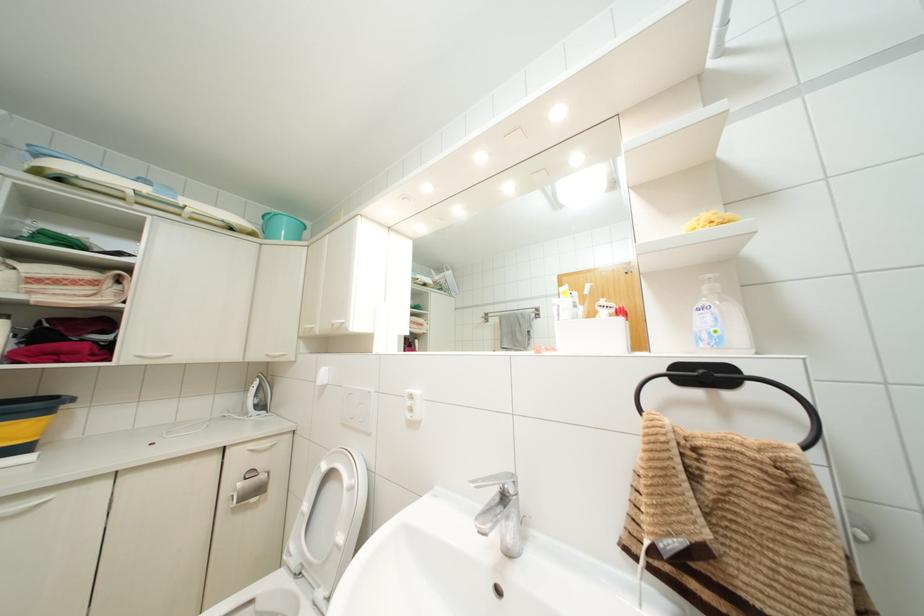
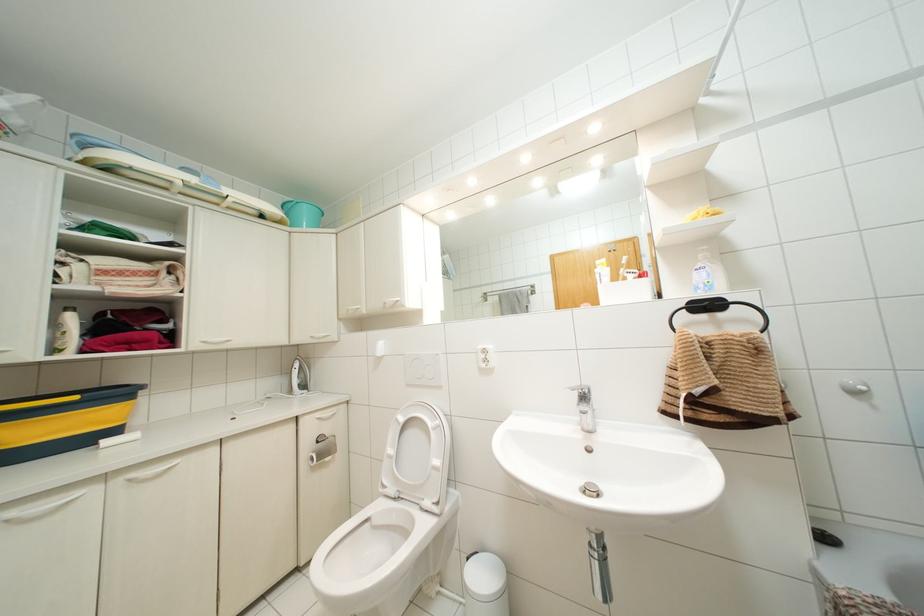
Where in the second image is the point corresponding to (274,357) from the first image?

(319, 338)